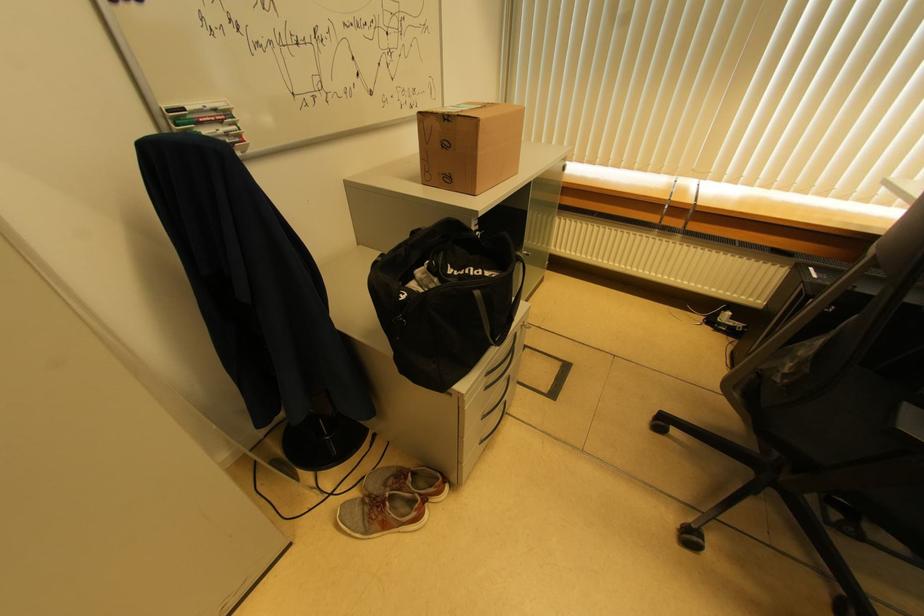
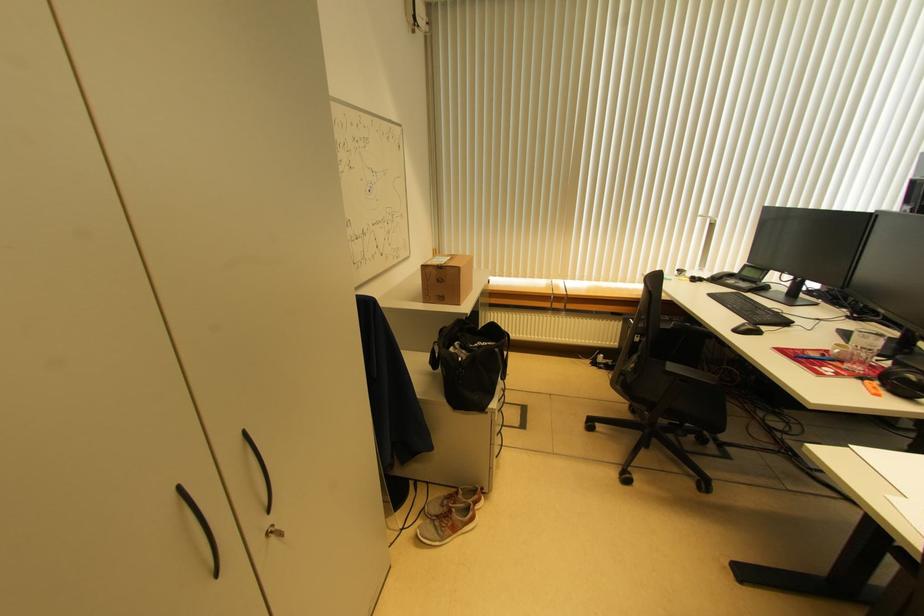
Locate, in the second image, the point that corresponds to pixel 479 296 in the first image.

(499, 353)